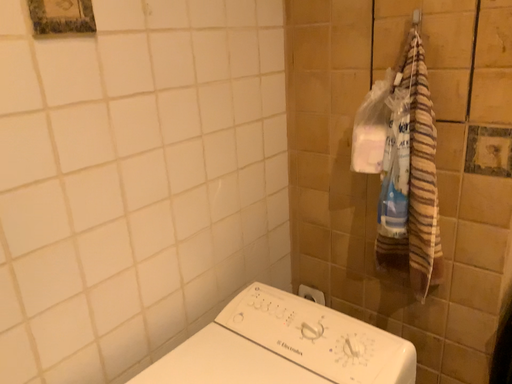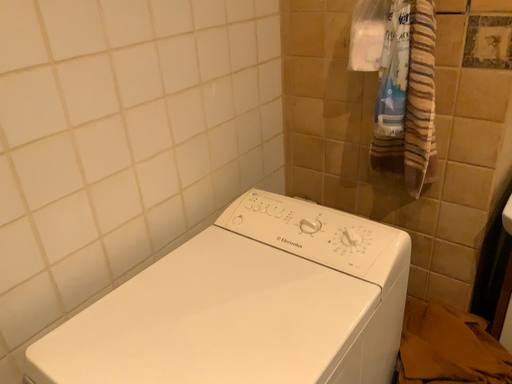
Question: Which way did the camera rotate in the video?

Choices:
 (A) rotated upward
 (B) rotated downward

Answer: (B)